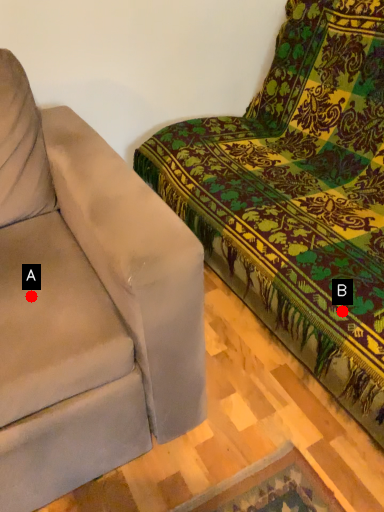
Question: Two points are circled on the image, labeled by A and B beside each circle. Which point is closer to the camera?

Choices:
 (A) A is closer
 (B) B is closer

Answer: (A)